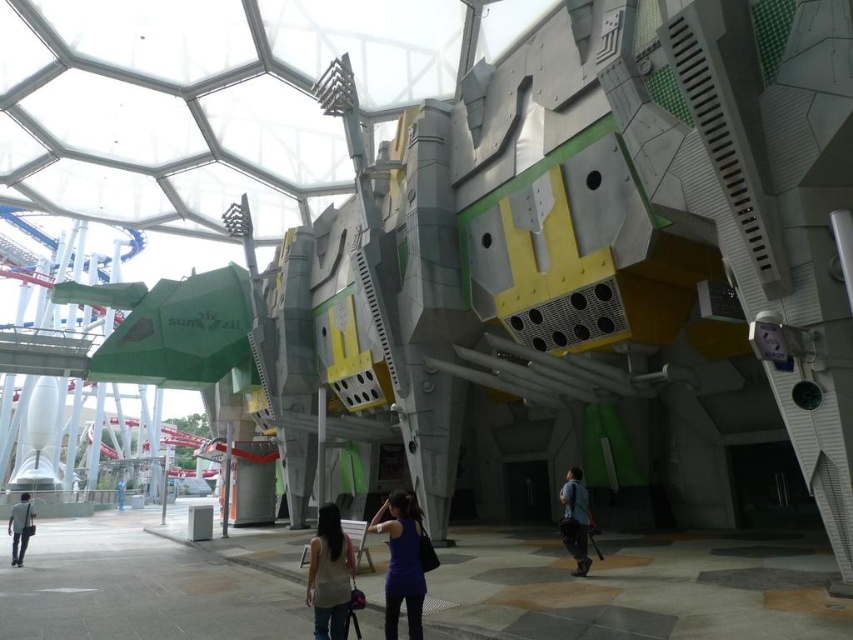
Which is behind, point (408, 524) or point (329, 618)?

The point (408, 524) is more distant.

The image size is (853, 640). Describe the element at coordinates (403, 561) in the screenshot. I see `blue fabric shirt at center` at that location.

The height and width of the screenshot is (640, 853). Identify the location of blue fabric shirt at center. click(x=403, y=561).

Can you confirm if dark blue fabric shirt at lower right is positioned to the left of light blue shirt at lower left?

In fact, dark blue fabric shirt at lower right is to the right of light blue shirt at lower left.

Consider the image. Does dark blue fabric shirt at lower right come behind light blue shirt at lower left?

No, dark blue fabric shirt at lower right is in front of light blue shirt at lower left.

Find the location of `dark blue fabric shirt at lower right`. dark blue fabric shirt at lower right is located at coordinates (575, 520).

Does light beige fabric shirt at lower center appear on the left side of dark blue fabric shirt at lower right?

Correct, you'll find light beige fabric shirt at lower center to the left of dark blue fabric shirt at lower right.

This screenshot has height=640, width=853. In order to click on light beige fabric shirt at lower center in this screenshot , I will do `click(329, 573)`.

Where is `light beige fabric shirt at lower center`? The height and width of the screenshot is (640, 853). light beige fabric shirt at lower center is located at coordinates 329,573.